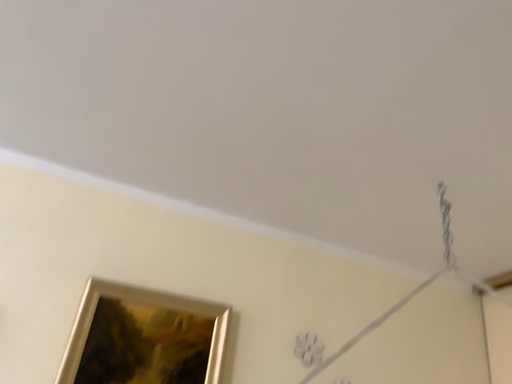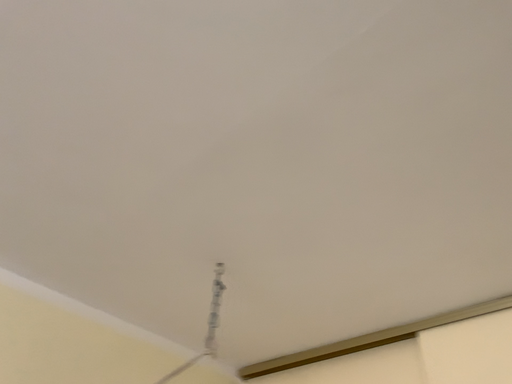
Question: How did the camera likely rotate when shooting the video?

Choices:
 (A) rotated left
 (B) rotated right

Answer: (B)